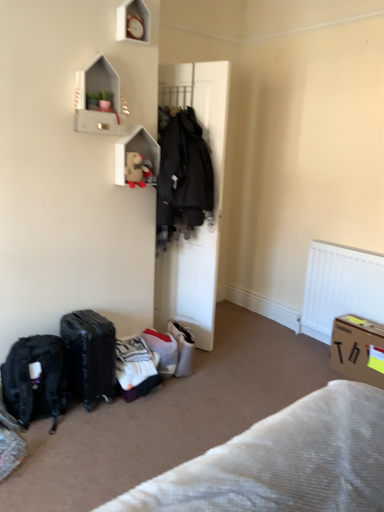
Question: Does black matte backpack at lower left have a smaller size compared to black matte suitcase at lower left?

Choices:
 (A) yes
 (B) no

Answer: (B)

Question: From a real-world perspective, is black matte backpack at lower left positioned over black matte suitcase at lower left based on gravity?

Choices:
 (A) yes
 (B) no

Answer: (B)

Question: Is the depth of black matte backpack at lower left less than that of black matte suitcase at lower left?

Choices:
 (A) yes
 (B) no

Answer: (A)

Question: Is black matte backpack at lower left bigger than black matte suitcase at lower left?

Choices:
 (A) no
 (B) yes

Answer: (B)

Question: Can you confirm if black matte backpack at lower left is thinner than black matte suitcase at lower left?

Choices:
 (A) yes
 (B) no

Answer: (B)

Question: Is black matte backpack at lower left oriented towards black matte suitcase at lower left?

Choices:
 (A) yes
 (B) no

Answer: (B)

Question: Is black matte suitcase at lower left facing away from white matte wooden shelf at upper center, the 2th shelf positioned from the top?

Choices:
 (A) no
 (B) yes

Answer: (A)

Question: From the image's perspective, is black matte suitcase at lower left beneath white matte wooden shelf at upper center, the 2th shelf positioned from the top?

Choices:
 (A) no
 (B) yes

Answer: (B)

Question: Is the position of black matte suitcase at lower left less distant than that of white matte wooden shelf at upper center, the 2th shelf positioned from the top?

Choices:
 (A) no
 (B) yes

Answer: (B)

Question: Does black matte suitcase at lower left contain white matte wooden shelf at upper center, the first shelf ordered from the bottom?

Choices:
 (A) no
 (B) yes

Answer: (A)

Question: Is black matte suitcase at lower left further to camera compared to white matte wooden shelf at upper center, the first shelf ordered from the bottom?

Choices:
 (A) yes
 (B) no

Answer: (B)

Question: From a real-world perspective, is black matte suitcase at lower left positioned over white matte wooden shelf at upper center, the 2th shelf positioned from the top, based on gravity?

Choices:
 (A) yes
 (B) no

Answer: (B)

Question: Does white textured blanket at lower right have a lesser height compared to fluffy beige plush at upper center?

Choices:
 (A) no
 (B) yes

Answer: (B)